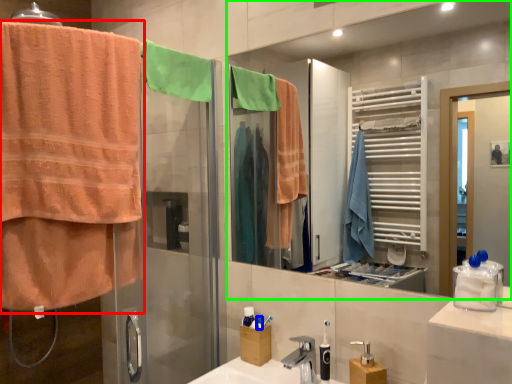
Question: Which object is the farthest from towel (highlighted by a red box)? Choose among these: toiletry (highlighted by a blue box) or mirror (highlighted by a green box).

Choices:
 (A) toiletry
 (B) mirror

Answer: (B)